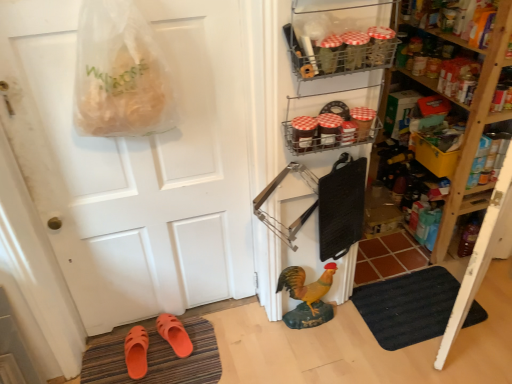
Question: Is wooden shelves at right, which appears as the third shelf when viewed from the left, oriented towards orange rubber slippers at lower left, which is the second footwear from left to right?

Choices:
 (A) no
 (B) yes

Answer: (B)

Question: Considering the relative sizes of wooden shelves at right, the 3th shelf positioned from the front, and orange rubber slippers at lower left, which is the second footwear from left to right, in the image provided, is wooden shelves at right, the 3th shelf positioned from the front, thinner than orange rubber slippers at lower left, which is the second footwear from left to right,?

Choices:
 (A) yes
 (B) no

Answer: (B)

Question: Does wooden shelves at right, which appears as the third shelf when viewed from the left, come behind orange rubber slippers at lower left, arranged as the 1th footwear when viewed from the right?

Choices:
 (A) yes
 (B) no

Answer: (B)

Question: Would you say wooden shelves at right, the 3th shelf positioned from the front, is outside orange rubber slippers at lower left, which is the second footwear from left to right?

Choices:
 (A) no
 (B) yes

Answer: (B)

Question: From the image's perspective, is wooden shelves at right, the 3th shelf positioned from the front, below orange rubber slippers at lower left, which is the second footwear from left to right?

Choices:
 (A) no
 (B) yes

Answer: (A)

Question: Is wooden shelves at right, the 3th shelf positioned from the front, to the left of orange rubber slippers at lower left, arranged as the 1th footwear when viewed from the right, from the viewer's perspective?

Choices:
 (A) no
 (B) yes

Answer: (A)

Question: Is metallic wire rack at upper center, acting as the 2th shelf starting from the back, oriented away from wooden shelves at right, which appears as the third shelf when viewed from the left?

Choices:
 (A) yes
 (B) no

Answer: (B)

Question: Can you confirm if metallic wire rack at upper center, marked as the 2th shelf in a front-to-back arrangement, is positioned to the left of wooden shelves at right, which is counted as the first shelf, starting from the right?

Choices:
 (A) yes
 (B) no

Answer: (A)

Question: Considering the relative sizes of metallic wire rack at upper center, acting as the 2th shelf starting from the back, and wooden shelves at right, which is counted as the first shelf, starting from the right, in the image provided, is metallic wire rack at upper center, acting as the 2th shelf starting from the back, smaller than wooden shelves at right, which is counted as the first shelf, starting from the right,?

Choices:
 (A) yes
 (B) no

Answer: (A)

Question: Considering the relative positions of metallic wire rack at upper center, acting as the 2th shelf starting from the back, and wooden shelves at right, which is counted as the first shelf, starting from the right, in the image provided, is metallic wire rack at upper center, acting as the 2th shelf starting from the back, behind wooden shelves at right, which is counted as the first shelf, starting from the right,?

Choices:
 (A) no
 (B) yes

Answer: (A)

Question: From the image's perspective, does metallic wire rack at upper center, which is the second shelf from left to right, appear lower than wooden shelves at right, which appears as the third shelf when viewed from the left?

Choices:
 (A) no
 (B) yes

Answer: (B)

Question: Is metallic wire rack at upper center, the 2th shelf positioned from the right, thinner than wooden shelves at right, which appears as the third shelf when viewed from the left?

Choices:
 (A) no
 (B) yes

Answer: (B)

Question: Can you confirm if metallic wire rack at upper center, the 2th shelf positioned from the right, is positioned to the left of metallic wire rack at upper right, the third shelf viewed from the back?

Choices:
 (A) no
 (B) yes

Answer: (A)